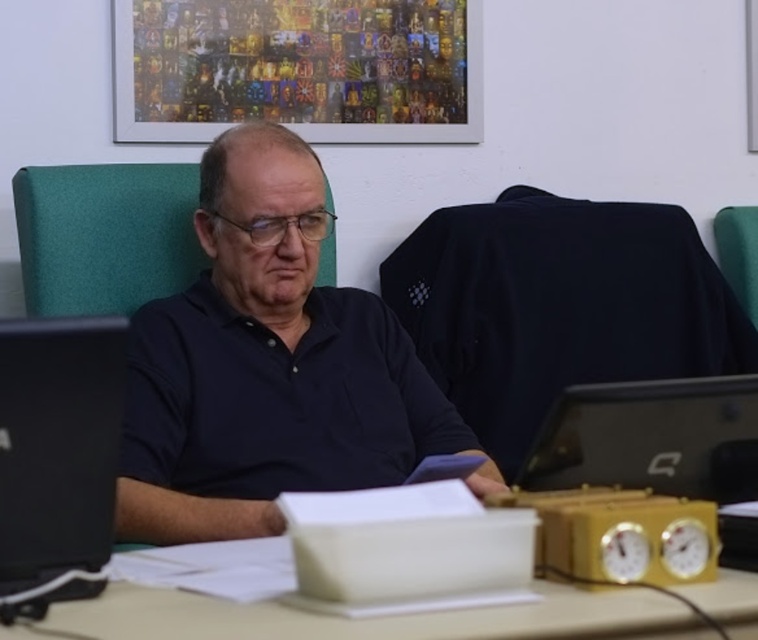
You are an assistant trying to organize the items on the desk. You see the dark blue shirt at center and the black fabric at center. Which item is wider?

The black fabric at center is wider than the dark blue shirt at center.

You are organizing a desk and see the black fabric at center and the yellow plastic computer desk at center. Which object is located to the right of the other?

The black fabric at center is positioned on the right side of yellow plastic computer desk at center, so the black fabric at center is to the right of the yellow plastic computer desk at center.

The man is wearing a dark blue shirt at center. If you were to draw a straight line from the top edge of the image to the bottom edge, passing through point (265, 364), would that line intersect the dark blue shirt at center?

Yes, because the dark blue shirt at center is located at point (265, 364), so a straight line drawn through that point would intersect it.